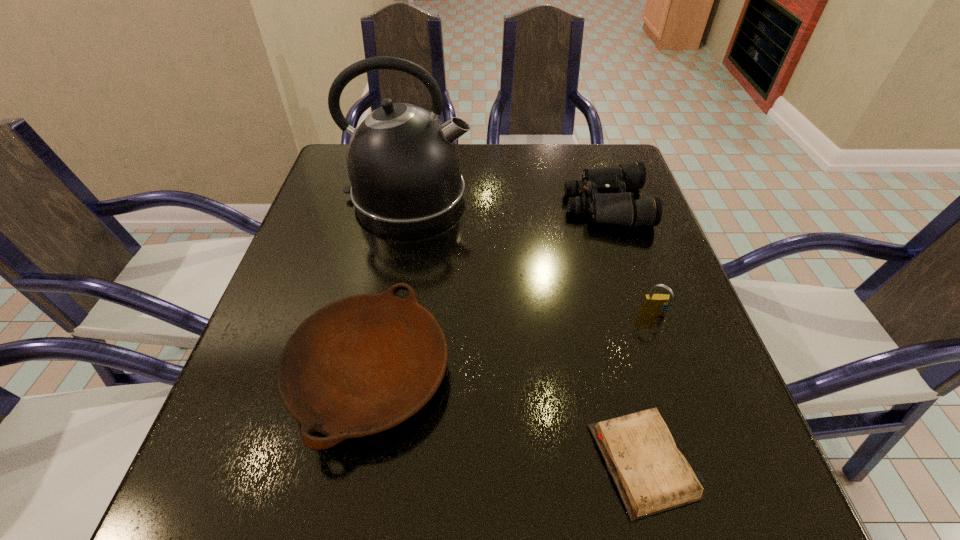
The image size is (960, 540). In order to click on free space that is in between the plate and the kettle in this screenshot , I will do `click(389, 285)`.

The image size is (960, 540). I want to click on free space that is in between the diary and the padlock, so click(649, 388).

The image size is (960, 540). Identify the location of free space between the tallest object and the padlock. pyautogui.click(x=532, y=255).

The width and height of the screenshot is (960, 540). In order to click on free spot between the shortest object and the plate in this screenshot , I will do `click(507, 417)`.

Where is `free point between the binoculars and the tallest object`? This screenshot has width=960, height=540. free point between the binoculars and the tallest object is located at coordinates (507, 200).

You are a GUI agent. You are given a task and a screenshot of the screen. Output one action in this format:
    pyautogui.click(x=<x>, y=<y>)
    Task: Click on the vacant space in between the fourth shortest object and the binoculars
    This screenshot has width=960, height=540.
    Given the screenshot: What is the action you would take?
    pyautogui.click(x=630, y=260)

Where is `free point between the diary and the second tallest object`? Image resolution: width=960 pixels, height=540 pixels. free point between the diary and the second tallest object is located at coordinates (649, 388).

Image resolution: width=960 pixels, height=540 pixels. I want to click on vacant area that lies between the second tallest object and the plate, so click(x=513, y=345).

The width and height of the screenshot is (960, 540). Identify the location of vacant point located between the kettle and the binoculars. (507, 200).

The image size is (960, 540). I want to click on the fourth closest object relative to the binoculars, so [652, 476].